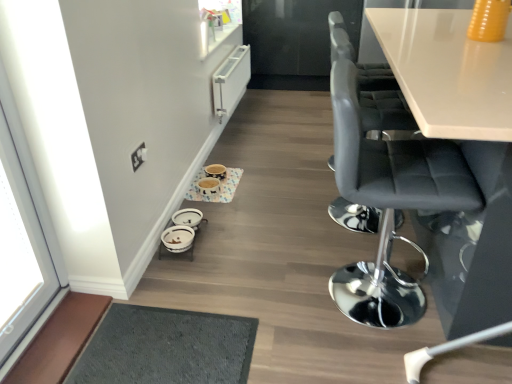
Find the location of a particular element. This screenshot has height=384, width=512. vacant space underneath white glass window at left (from a real-world perspective) is located at coordinates (37, 337).